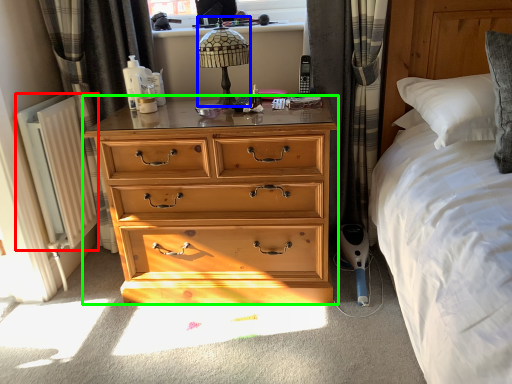
Question: Estimate the real-world distances between objects in this image. Which object is farther from radiator (highlighted by a red box), lamp (highlighted by a blue box) or chest of drawers (highlighted by a green box)?

Choices:
 (A) lamp
 (B) chest of drawers

Answer: (A)